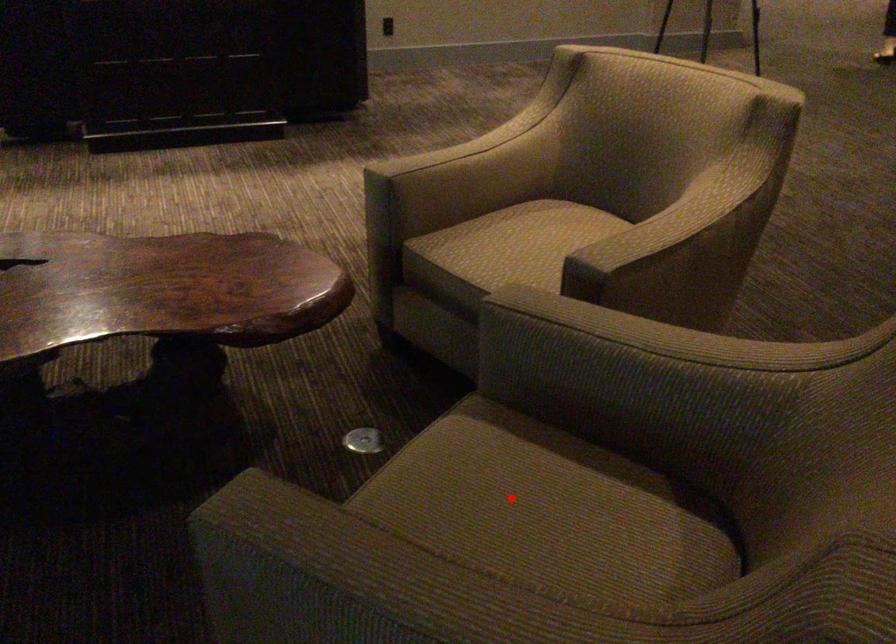
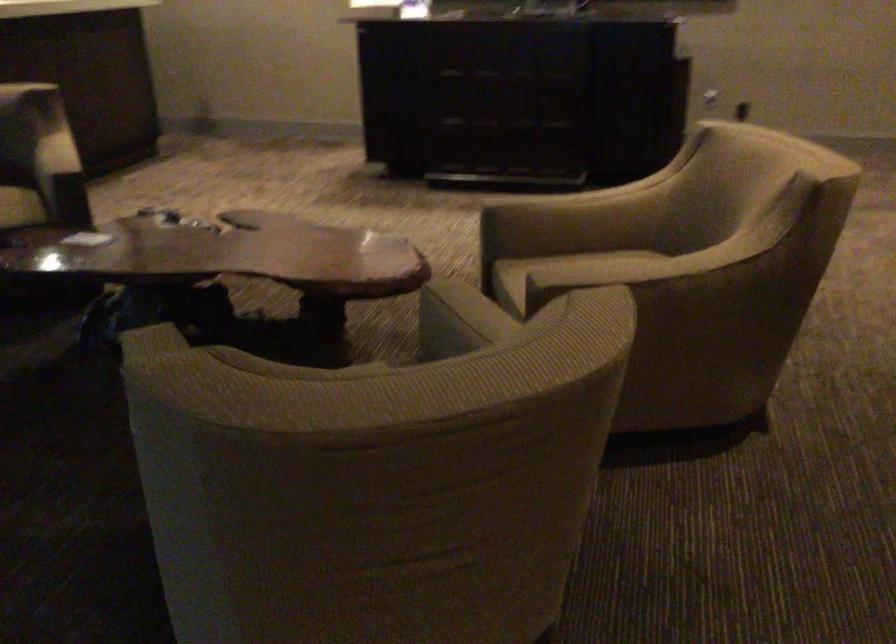
Question: I am providing you with two images of the same scene from different viewpoints. A red point is marked on the first image. At the location where the point appears in image 1, is it still visible in image 2?

Choices:
 (A) Yes
 (B) No

Answer: (B)